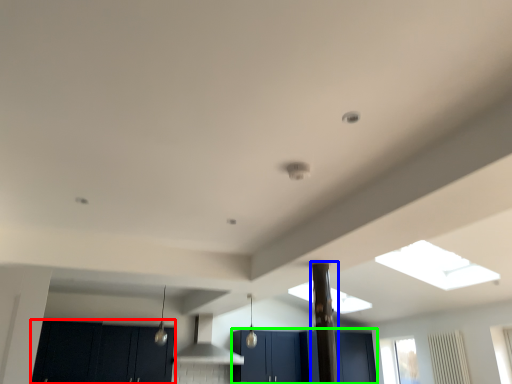
Question: Based on their relative distances, which object is farther from cabinetry (highlighted by a red box)? Choose from pillar (highlighted by a blue box) and cabinetry (highlighted by a green box).

Choices:
 (A) pillar
 (B) cabinetry

Answer: (A)